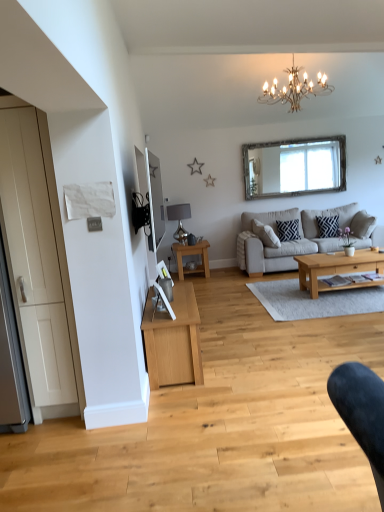
Where is `vacant area that lies in front of light brown wooden coffee table at center, which ranks as the first coffee table in front-to-back order`? This screenshot has height=512, width=384. vacant area that lies in front of light brown wooden coffee table at center, which ranks as the first coffee table in front-to-back order is located at coordinates (350, 306).